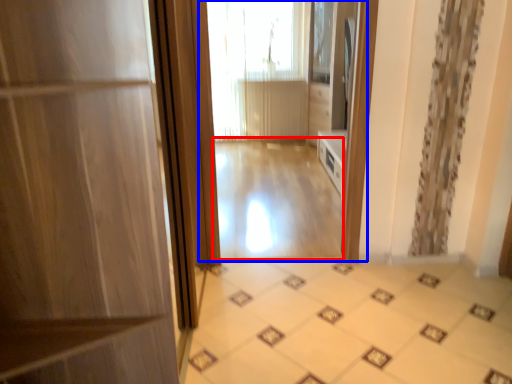
Question: Which object is further to the camera taking this photo, corridor (highlighted by a red box) or residence (highlighted by a blue box)?

Choices:
 (A) corridor
 (B) residence

Answer: (A)